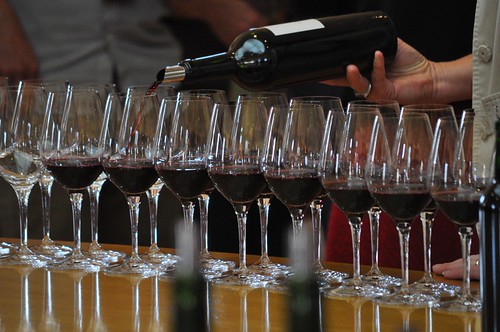
The width and height of the screenshot is (500, 332). I want to click on wine glasses, so click(25, 136), click(67, 134), click(135, 134), click(182, 136), click(230, 143), click(282, 147), click(352, 157), click(389, 160), click(451, 168), click(440, 107).